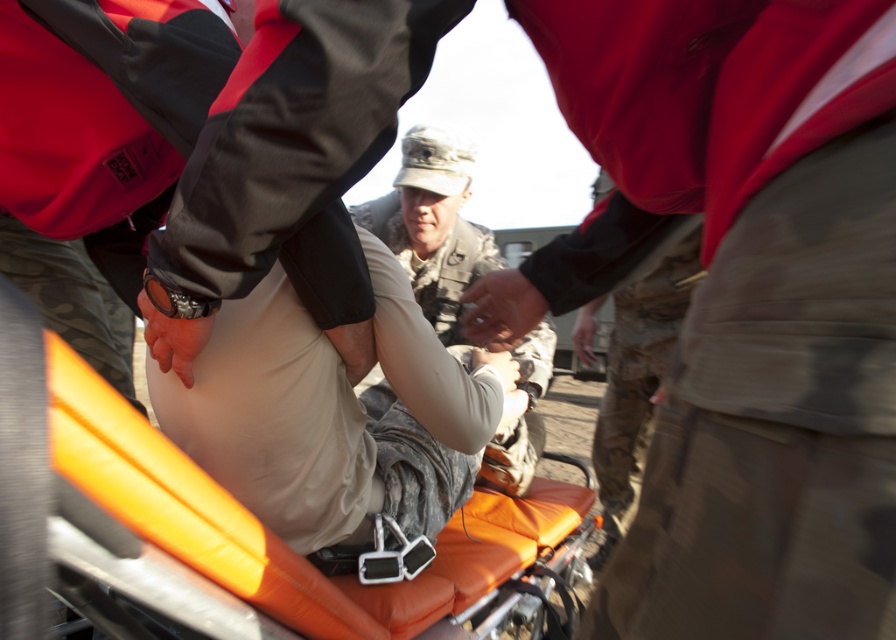
Is orange fabric stretcher at center behind camouflage uniform at center?

No.

The height and width of the screenshot is (640, 896). What are the coordinates of `orange fabric stretcher at center` in the screenshot? It's located at (274, 536).

Is point (567, 532) positioned in front of point (448, 264)?

That is True.

At what (x,y) coordinates should I click in order to perform the action: click on orange fabric stretcher at center. Please return your answer as a coordinate pair (x, y). The width and height of the screenshot is (896, 640). Looking at the image, I should click on (274, 536).